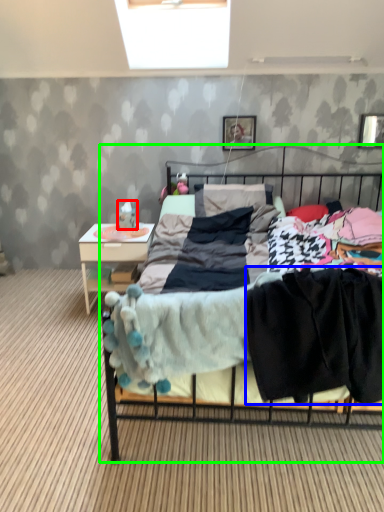
Question: Which object is the closest to the toy (highlighted by a red box)? Choose among these: clothing (highlighted by a blue box) or bed (highlighted by a green box).

Choices:
 (A) clothing
 (B) bed

Answer: (B)